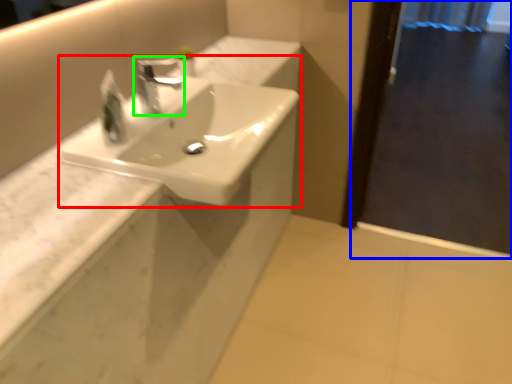
Question: Which object is positioned farthest from sink (highlighted by a red box)? Select from screen door (highlighted by a blue box) and tap (highlighted by a green box).

Choices:
 (A) screen door
 (B) tap

Answer: (A)